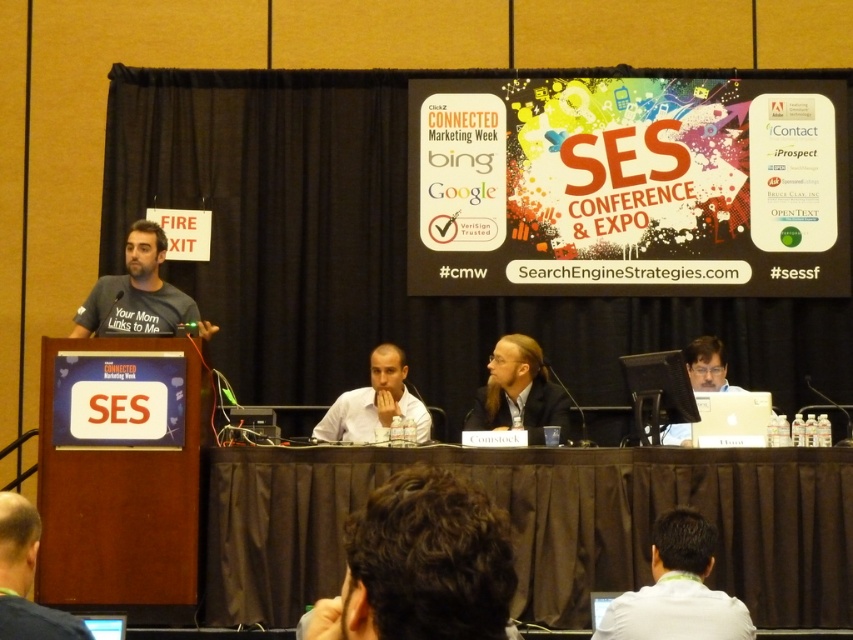
Which is in front, point (782, 452) or point (387, 502)?

Point (387, 502) is more forward.

Who is more distant from viewer, (747, 516) or (479, 636)?

Positioned behind is point (747, 516).

The width and height of the screenshot is (853, 640). Find the location of `brown fabric table at lower center`. brown fabric table at lower center is located at coordinates (543, 524).

This screenshot has width=853, height=640. I want to click on brown fabric table at lower center, so click(543, 524).

Can you confirm if dark brown hair at lower center is smaller than dark gray t-shirt at left?

Yes, dark brown hair at lower center is smaller than dark gray t-shirt at left.

Is point (376, 548) closer to viewer compared to point (158, 320)?

Yes, it is.

Where is `dark brown hair at lower center`? dark brown hair at lower center is located at coordinates (422, 564).

Can you confirm if dark brown hair at lower center is positioned above matte black laptop at right?

No, dark brown hair at lower center is not above matte black laptop at right.

How much distance is there between dark brown hair at lower center and matte black laptop at right?

8.82 meters

Between point (366, 611) and point (683, 422), which one is positioned in front?

Point (366, 611)

The height and width of the screenshot is (640, 853). What are the coordinates of `dark brown hair at lower center` in the screenshot? It's located at (422, 564).